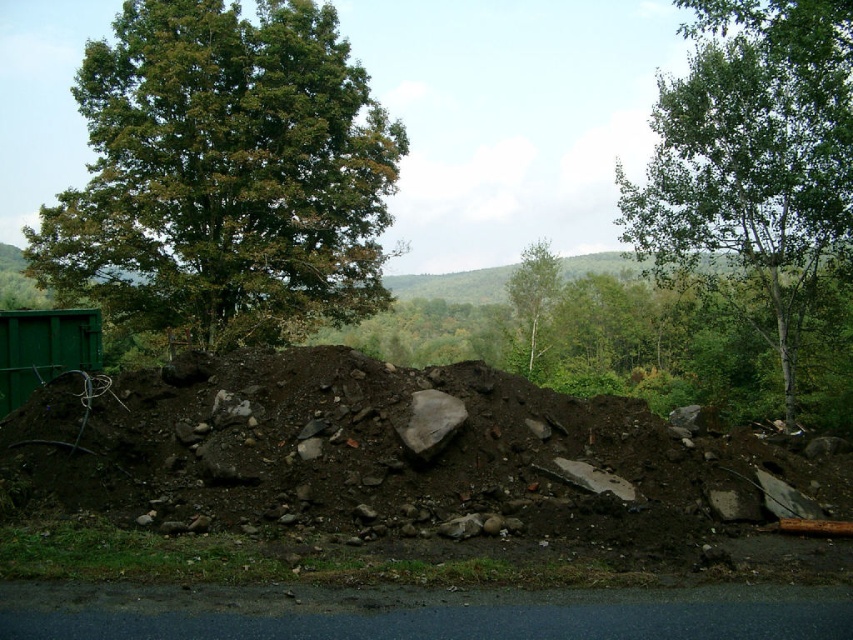
Between brown/dry soil at center and green smooth tree at center, which one has less height?

brown/dry soil at center is shorter.

Measure the distance from brown/dry soil at center to green smooth tree at center.

brown/dry soil at center and green smooth tree at center are 173.10 feet apart.

I want to click on brown/dry soil at center, so click(x=390, y=477).

This screenshot has height=640, width=853. What are the coordinates of `brown/dry soil at center` in the screenshot? It's located at (390, 477).

Based on the photo, which is more to the left, brown/dry soil at center or green leafy tree at upper right?

brown/dry soil at center

Can you confirm if brown/dry soil at center is wider than green leafy tree at upper right?

In fact, brown/dry soil at center might be narrower than green leafy tree at upper right.

Which is behind, point (224, 390) or point (836, 163)?

The point (836, 163) is more distant.

This screenshot has height=640, width=853. I want to click on brown/dry soil at center, so click(390, 477).

Does point (422, 432) come farther from viewer compared to point (242, 164)?

No, it is in front of (242, 164).

Does brown/dry soil at center have a lesser width compared to green leafy tree at upper left?

Yes.

Describe the element at coordinates (390, 477) in the screenshot. I see `brown/dry soil at center` at that location.

Locate an element on the screen. Image resolution: width=853 pixels, height=640 pixels. brown/dry soil at center is located at coordinates (390, 477).